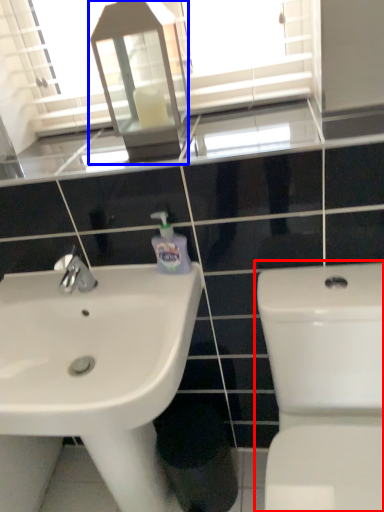
Question: Among these objects, which one is nearest to the camera, toilet (highlighted by a red box) or medicine cabinet (highlighted by a blue box)?

Choices:
 (A) toilet
 (B) medicine cabinet

Answer: (A)